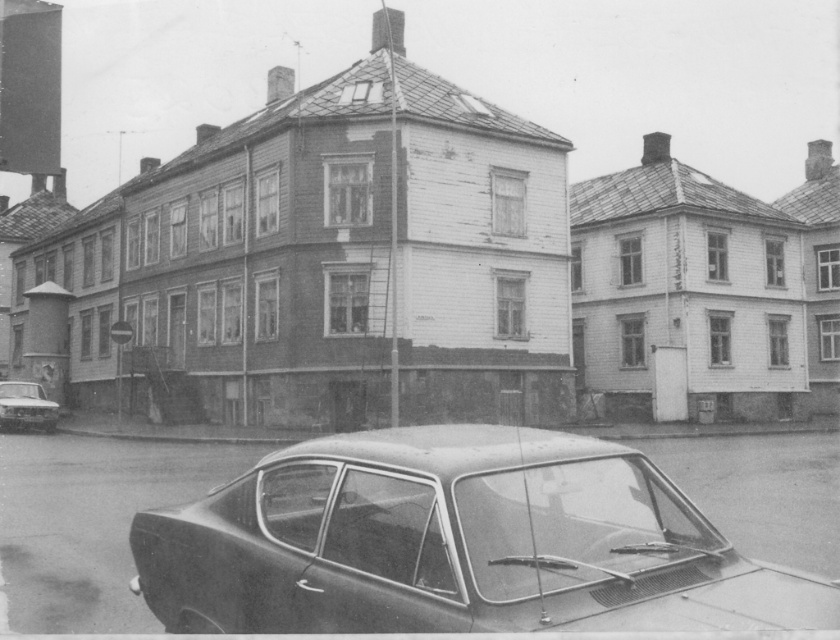
Question: Is dark gray metallic car at lower center to the right of shiny silver sedan at lower left from the viewer's perspective?

Choices:
 (A) no
 (B) yes

Answer: (B)

Question: Considering the relative positions of dark gray metallic car at lower center and shiny silver sedan at lower left in the image provided, where is dark gray metallic car at lower center located with respect to shiny silver sedan at lower left?

Choices:
 (A) right
 (B) left

Answer: (A)

Question: Is dark gray metallic car at lower center positioned in front of shiny silver sedan at lower left?

Choices:
 (A) no
 (B) yes

Answer: (B)

Question: Which of the following is the farthest from the observer?

Choices:
 (A) (258, 508)
 (B) (8, 388)

Answer: (B)